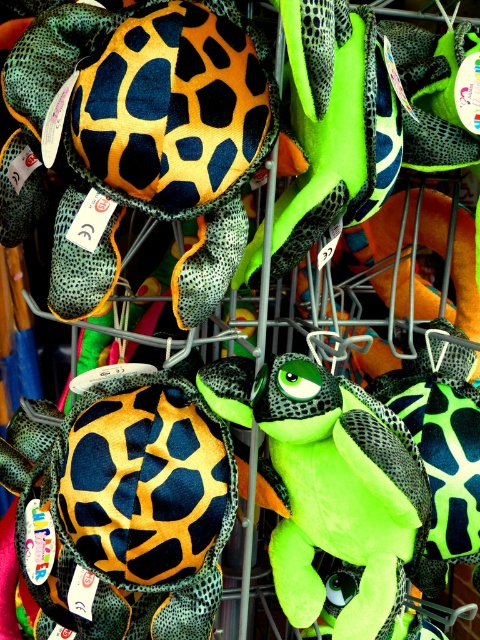
You are a customer in the store looking at the metal shelving unit. You want to pick up the neon green plush turtle at center. Is it possible to reach it without moving the matte black plush turtle at center?

The neon green plush turtle at center is behind the matte black plush turtle at center, so you cannot reach it without moving the matte black plush turtle at center.